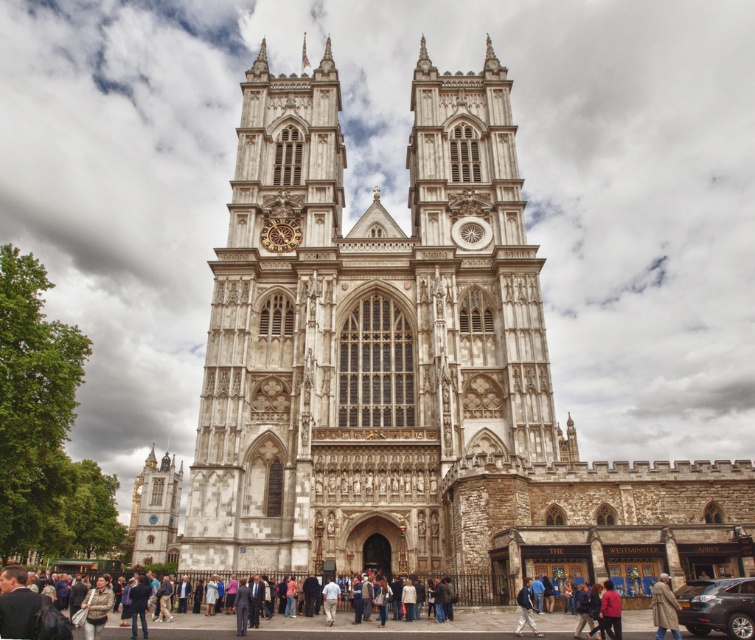
Question: Is stone clock tower at lower left bigger than light brown leather coat at lower right?

Choices:
 (A) yes
 (B) no

Answer: (A)

Question: Which object is positioned closest to the stone clock tower at lower left?

Choices:
 (A) blue denim jacket at lower center
 (B) light brown leather coat at lower right

Answer: (A)

Question: Is light brown leather coat at lower right to the left of blue denim jacket at lower center from the viewer's perspective?

Choices:
 (A) yes
 (B) no

Answer: (B)

Question: Is light brown leather coat at lower right wider than blue denim jacket at lower center?

Choices:
 (A) yes
 (B) no

Answer: (A)

Question: Which of these objects is positioned closest to the stone clock tower at lower left?

Choices:
 (A) blue denim jacket at lower center
 (B) light brown leather coat at lower right

Answer: (A)

Question: Which point is closer to the camera?

Choices:
 (A) blue denim jacket at lower center
 (B) light brown leather coat at lower right
 (C) stone clock tower at lower left

Answer: (B)